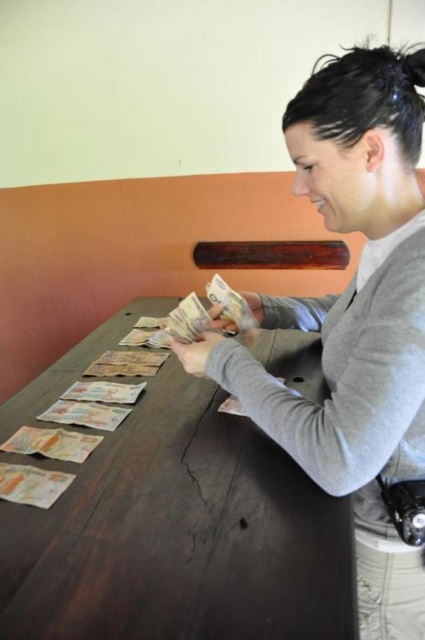
Question: Is dark brown wood table at center in front of gray matte sweater at center?

Choices:
 (A) yes
 (B) no

Answer: (A)

Question: Does dark brown wood table at center appear on the right side of gray matte sweater at center?

Choices:
 (A) no
 (B) yes

Answer: (A)

Question: In this image, where is dark brown wood table at center located relative to gray matte sweater at center?

Choices:
 (A) right
 (B) left

Answer: (B)

Question: Which point is farther to the camera?

Choices:
 (A) (197, 440)
 (B) (419, 381)

Answer: (A)

Question: Which point is farther to the camera?

Choices:
 (A) gray matte sweater at center
 (B) dark brown wood table at center

Answer: (A)

Question: Which point appears farthest from the camera in this image?

Choices:
 (A) (156, 589)
 (B) (388, 394)

Answer: (A)